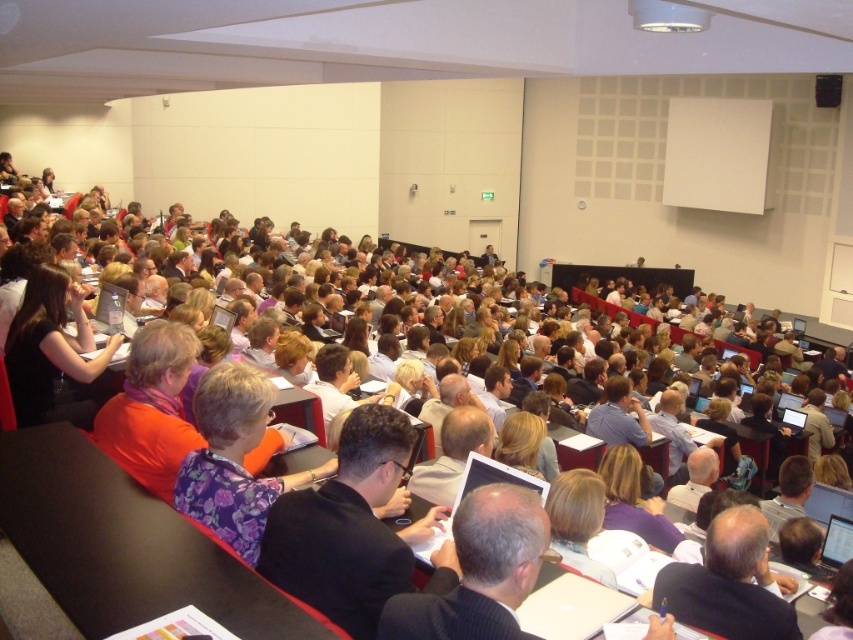
Is dark suit at center to the right of floral fabric shirt at center from the viewer's perspective?

Yes, dark suit at center is to the right of floral fabric shirt at center.

Is dark suit at center to the left of floral fabric shirt at center from the viewer's perspective?

In fact, dark suit at center is to the right of floral fabric shirt at center.

The height and width of the screenshot is (640, 853). I want to click on dark suit at center, so click(349, 528).